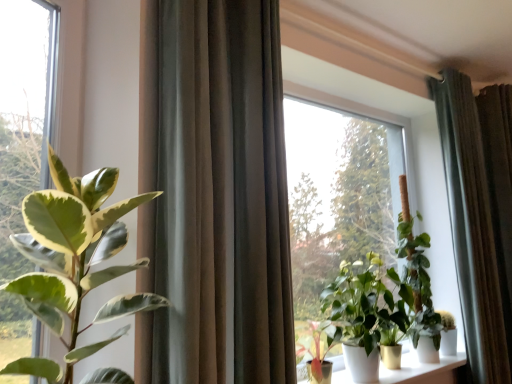
Question: Is green matte plant at center, marked as the second houseplant in a front-to-back arrangement, taller than green matte plant at center, arranged as the 4th houseplant when viewed from the left?

Choices:
 (A) no
 (B) yes

Answer: (A)

Question: Is green matte plant at center, the second houseplant in the left-to-right sequence, positioned behind green matte plant at center, arranged as the 4th houseplant when viewed from the left?

Choices:
 (A) yes
 (B) no

Answer: (B)

Question: Is the depth of green matte plant at center, the second houseplant in the left-to-right sequence, less than that of green matte plant at center, arranged as the 4th houseplant when viewed from the left?

Choices:
 (A) no
 (B) yes

Answer: (B)

Question: Does green matte plant at center, positioned as the third houseplant in right-to-left order, have a larger size compared to green matte plant at center, arranged as the 4th houseplant when viewed from the left?

Choices:
 (A) yes
 (B) no

Answer: (B)

Question: From a real-world perspective, is green matte plant at center, the second houseplant in the left-to-right sequence, under green matte plant at center, arranged as the 4th houseplant when viewed from the left?

Choices:
 (A) yes
 (B) no

Answer: (A)

Question: Looking at the image, does green glossy plant at center, the 2th houseplant positioned from the back, seem bigger or smaller compared to satin brown curtain at center, the 2th curtain from the back?

Choices:
 (A) big
 (B) small

Answer: (A)

Question: From a real-world perspective, is green glossy plant at center, acting as the second houseplant starting from the right, physically located above or below satin brown curtain at center, positioned as the 1th curtain in left-to-right order?

Choices:
 (A) below
 (B) above

Answer: (A)

Question: Looking at their shapes, would you say green glossy plant at center, which appears as the third houseplant when viewed from the left, is wider or thinner than satin brown curtain at center, the 2th curtain from the back?

Choices:
 (A) wide
 (B) thin

Answer: (A)

Question: Is green glossy plant at center, the 2th houseplant positioned from the back, spatially inside satin brown curtain at center, positioned as the 1th curtain in left-to-right order, or outside of it?

Choices:
 (A) outside
 (B) inside

Answer: (A)

Question: Is white glossy pots at lower center in front of or behind green glossy plant at center, acting as the second houseplant starting from the right, in the image?

Choices:
 (A) behind
 (B) front

Answer: (A)

Question: Is point (301, 382) positioned closer to the camera than point (332, 281)?

Choices:
 (A) closer
 (B) farther

Answer: (A)

Question: From the image's perspective, is white glossy pots at lower center positioned above or below green glossy plant at center, the 2th houseplant positioned from the back?

Choices:
 (A) above
 (B) below

Answer: (B)

Question: In terms of height, does white glossy pots at lower center look taller or shorter compared to green glossy plant at center, the 3th houseplant in the front-to-back sequence?

Choices:
 (A) tall
 (B) short

Answer: (B)

Question: Looking at the image, does green matte plant at center, which is the fourth houseplant in front-to-back order, seem bigger or smaller compared to green leafy plant at left?

Choices:
 (A) big
 (B) small

Answer: (A)

Question: Is green matte plant at center, which is the fourth houseplant in front-to-back order, wider or thinner than green leafy plant at left?

Choices:
 (A) wide
 (B) thin

Answer: (A)